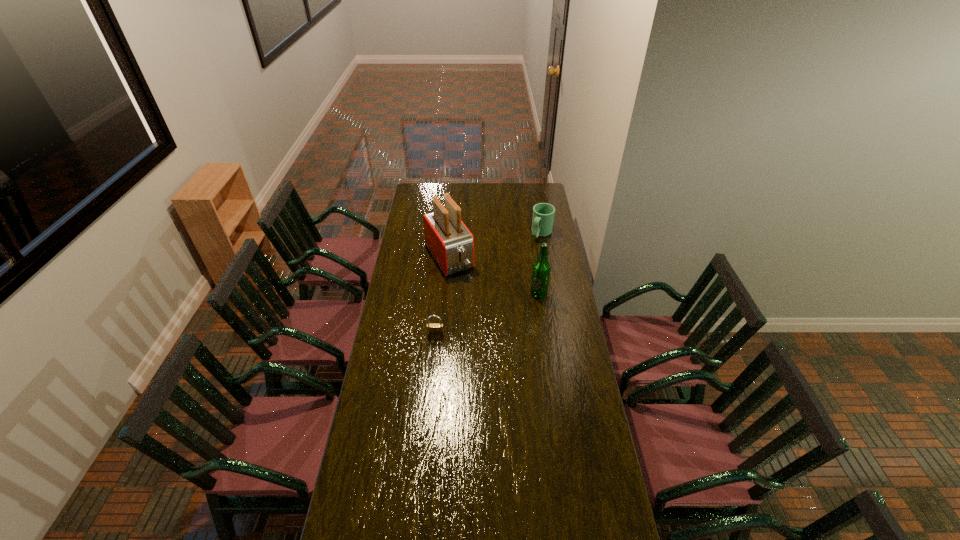
You are a GUI agent. You are given a task and a screenshot of the screen. Output one action in this format:
    pyautogui.click(x=<x>, y=<y>)
    Task: Click on the shortest object
    The image size is (960, 540).
    Given the screenshot: What is the action you would take?
    pyautogui.click(x=434, y=329)

Identify the location of padlock. (434, 329).

This screenshot has height=540, width=960. In order to click on beer bottle in this screenshot , I will do `click(541, 269)`.

Find the location of `toaster`. toaster is located at coordinates (450, 242).

In order to click on mug in this screenshot , I will do `click(543, 213)`.

This screenshot has width=960, height=540. I want to click on vacant point located 0.340m on the front-facing side of the shortest object, so click(429, 401).

The width and height of the screenshot is (960, 540). Find the location of `free space located 0.320m on the label of the beer bottle`. free space located 0.320m on the label of the beer bottle is located at coordinates (546, 351).

Find the location of a particular element. The image size is (960, 540). vacant region located on the front-facing side of the toaster is located at coordinates (477, 302).

Identify the location of free space located 0.300m on the front-facing side of the toaster. This screenshot has width=960, height=540. (484, 313).

At what (x,y) coordinates should I click in order to perform the action: click on vacant region located 0.220m on the front-facing side of the toaster. Please return your answer as a coordinate pair (x, y). The width and height of the screenshot is (960, 540). Looking at the image, I should click on (477, 302).